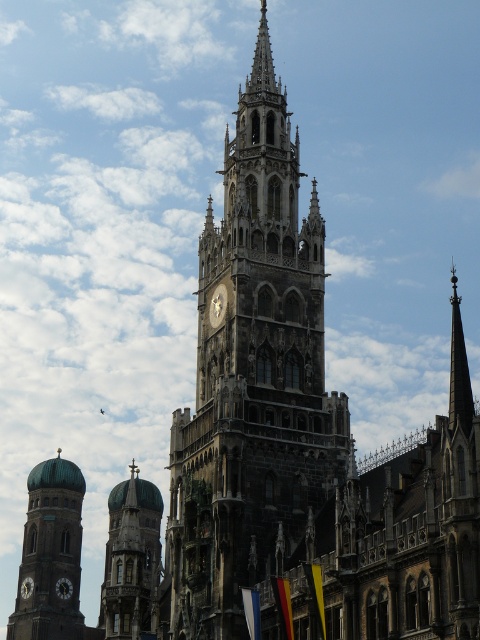
Question: Can you confirm if shiny silver spire at upper right is wider than matte black clock at lower left?

Choices:
 (A) yes
 (B) no

Answer: (A)

Question: Which is farther from the gold metallic clock at center?

Choices:
 (A) dark stone clock tower at center
 (B) matte black clock at lower left
 (C) green glazed dome at center
 (D) shiny silver spire at upper right

Answer: (B)

Question: Is shiny silver spire at upper right smaller than matte black clock at lower left?

Choices:
 (A) no
 (B) yes

Answer: (A)

Question: Is shiny silver spire at upper right to the left of matte black clock at lower left from the viewer's perspective?

Choices:
 (A) no
 (B) yes

Answer: (A)

Question: Which point appears farthest from the camera in this image?

Choices:
 (A) (29, 584)
 (B) (467, 422)
 (C) (54, 490)
 (D) (156, 618)

Answer: (C)

Question: Among these points, which one is nearest to the camera?

Choices:
 (A) (27, 582)
 (B) (215, 326)
 (C) (69, 522)
 (D) (156, 536)

Answer: (B)